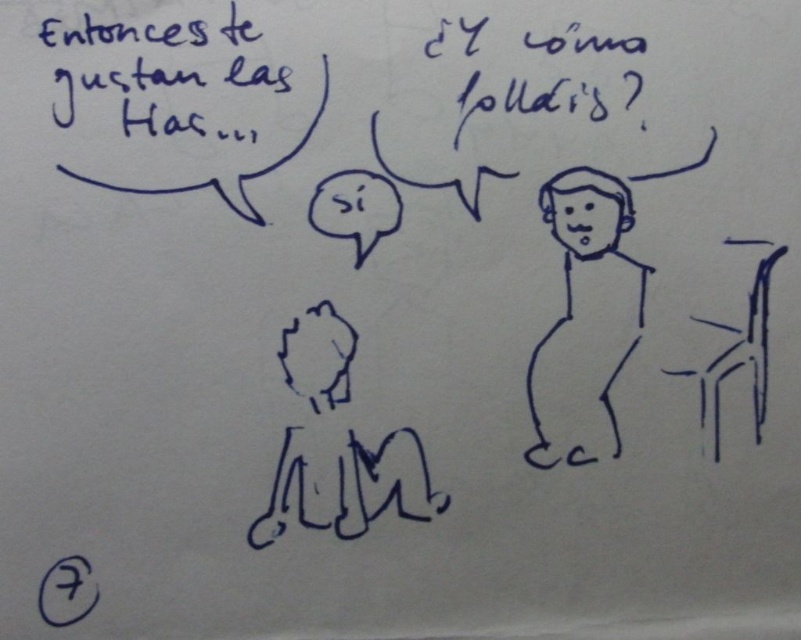
You are an art student analyzing a drawing. You notice two elements in the image. One is the smooth black figure at center and the other is the black handwritten text at upper left. Based on their positions, which element is placed lower in the image?

The smooth black figure at center is located below the black handwritten text at upper left, so the smooth black figure at center is placed lower in the image.